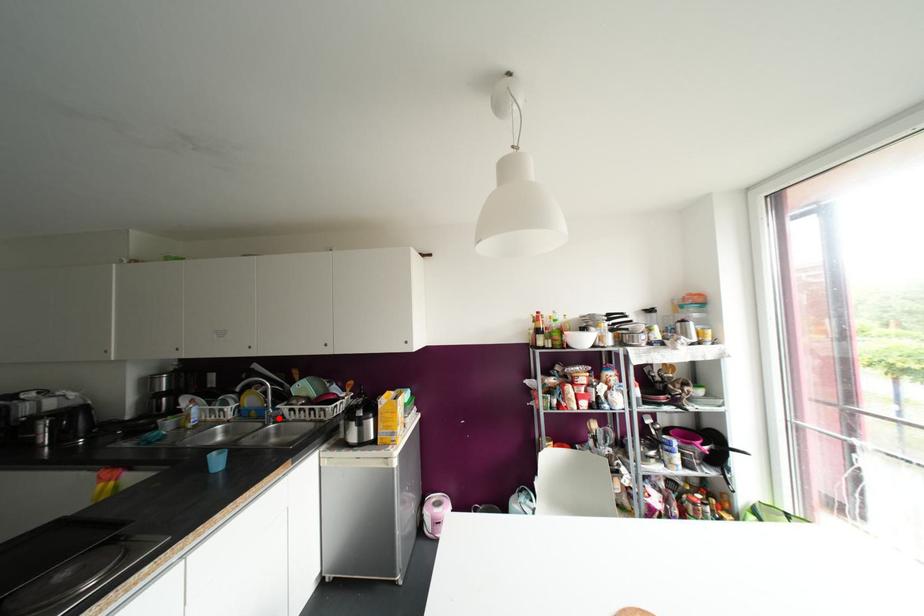
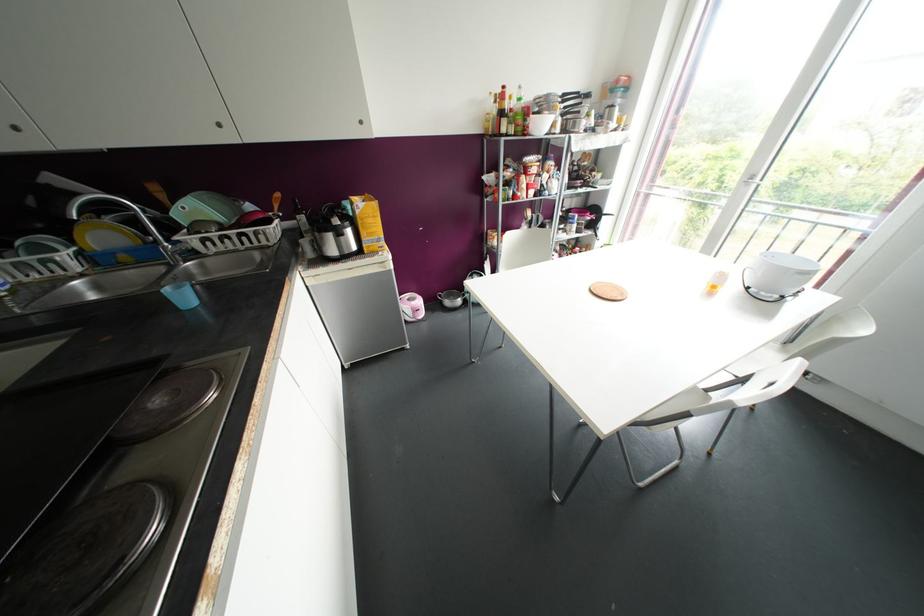
The point at the highlighted location is marked in the first image. Where is the corresponding point in the second image?

(192, 253)